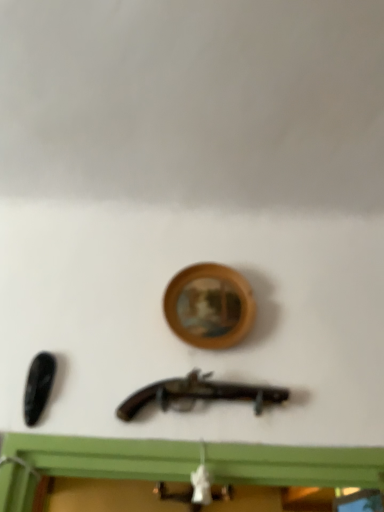
Question: From the image's perspective, is matte black revolver at center above or below wooden picture frame at center?

Choices:
 (A) below
 (B) above

Answer: (A)

Question: Looking at their shapes, would you say matte black revolver at center is wider or thinner than wooden picture frame at center?

Choices:
 (A) thin
 (B) wide

Answer: (B)

Question: Is matte black revolver at center spatially inside wooden picture frame at center, or outside of it?

Choices:
 (A) outside
 (B) inside

Answer: (A)

Question: Considering their positions, is wooden picture frame at center located in front of or behind matte black revolver at center?

Choices:
 (A) front
 (B) behind

Answer: (B)

Question: In terms of size, does wooden picture frame at center appear bigger or smaller than matte black revolver at center?

Choices:
 (A) big
 (B) small

Answer: (A)

Question: From the image's perspective, is wooden picture frame at center located above or below matte black revolver at center?

Choices:
 (A) below
 (B) above

Answer: (B)

Question: Is point (249, 298) closer or farther from the camera than point (198, 381)?

Choices:
 (A) closer
 (B) farther

Answer: (B)